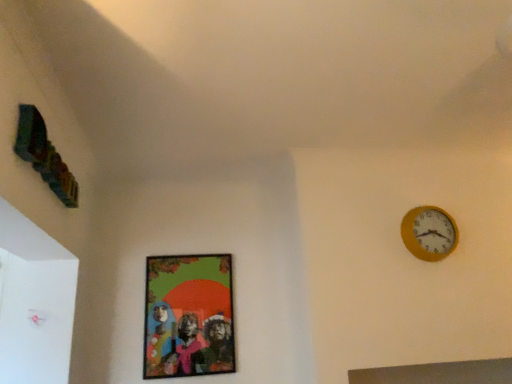
Question: From the image's perspective, is matte plastic picture frame at center located above or below yellow wooden clock at upper right?

Choices:
 (A) above
 (B) below

Answer: (B)

Question: From a real-world perspective, relative to yellow wooden clock at upper right, is matte plastic picture frame at center vertically above or below?

Choices:
 (A) below
 (B) above

Answer: (A)

Question: Is point (150, 292) positioned closer to the camera than point (437, 223)?

Choices:
 (A) farther
 (B) closer

Answer: (A)

Question: Looking at the image, does yellow wooden clock at upper right seem bigger or smaller compared to matte plastic picture frame at center?

Choices:
 (A) big
 (B) small

Answer: (B)

Question: In the image, is yellow wooden clock at upper right positioned in front of or behind matte plastic picture frame at center?

Choices:
 (A) behind
 (B) front

Answer: (B)

Question: Is point (443, 211) closer or farther from the camera than point (190, 321)?

Choices:
 (A) farther
 (B) closer

Answer: (B)

Question: From a real-world perspective, is yellow wooden clock at upper right positioned above or below matte plastic picture frame at center?

Choices:
 (A) above
 (B) below

Answer: (A)